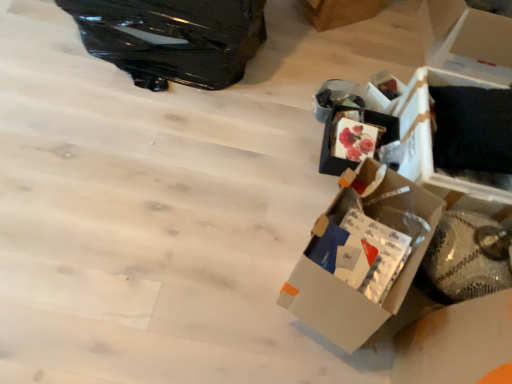
Identify the location of vacant space positioned to the left of white cardboard box at upper right, arranged as the 1th storage box when viewed from the back. Image resolution: width=512 pixels, height=384 pixels. (345, 80).